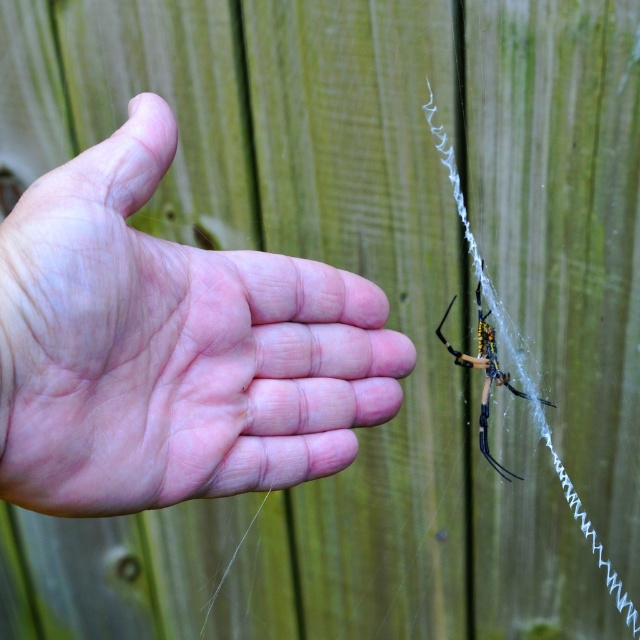
Question: Which of the following is the closest to the observer?

Choices:
 (A) (100, 230)
 (B) (500, 467)

Answer: (A)

Question: Is pink flesh at center positioned at the back of yellow fuzzy spider at center?

Choices:
 (A) yes
 (B) no

Answer: (B)

Question: From the image, what is the correct spatial relationship of pink flesh at center in relation to yellow fuzzy spider at center?

Choices:
 (A) left
 (B) right

Answer: (A)

Question: Does pink flesh at center have a smaller size compared to yellow fuzzy spider at center?

Choices:
 (A) yes
 (B) no

Answer: (B)